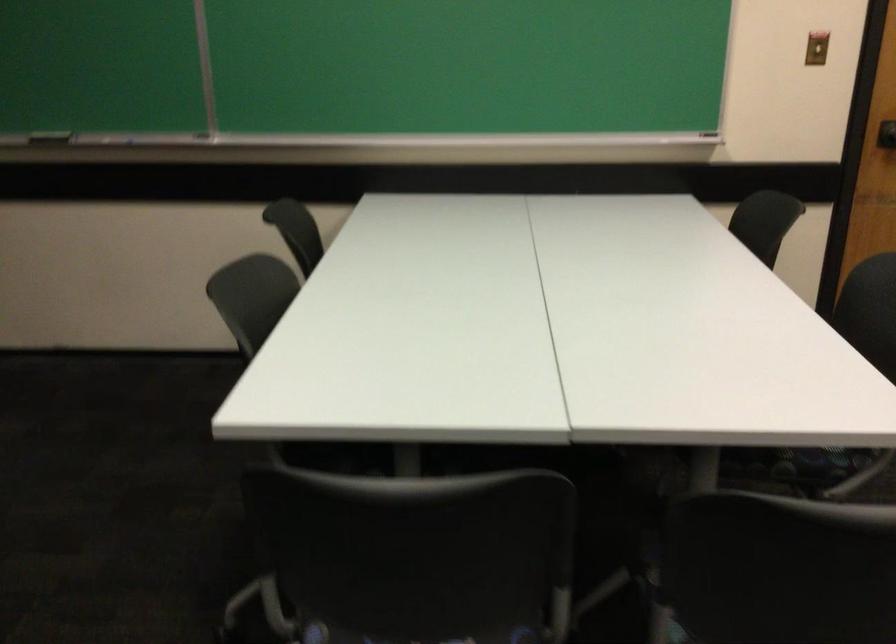
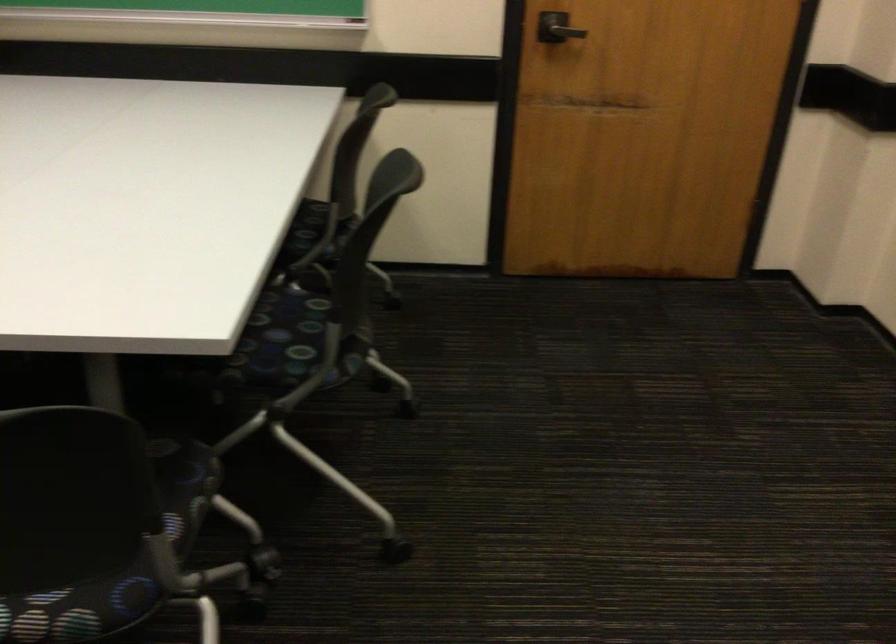
Question: Which direction would the cameraman need to move to produce the second image? Reply with the corresponding letter.

Choices:
 (A) Left
 (B) Right
 (C) Forward
 (D) Backward

Answer: (B)